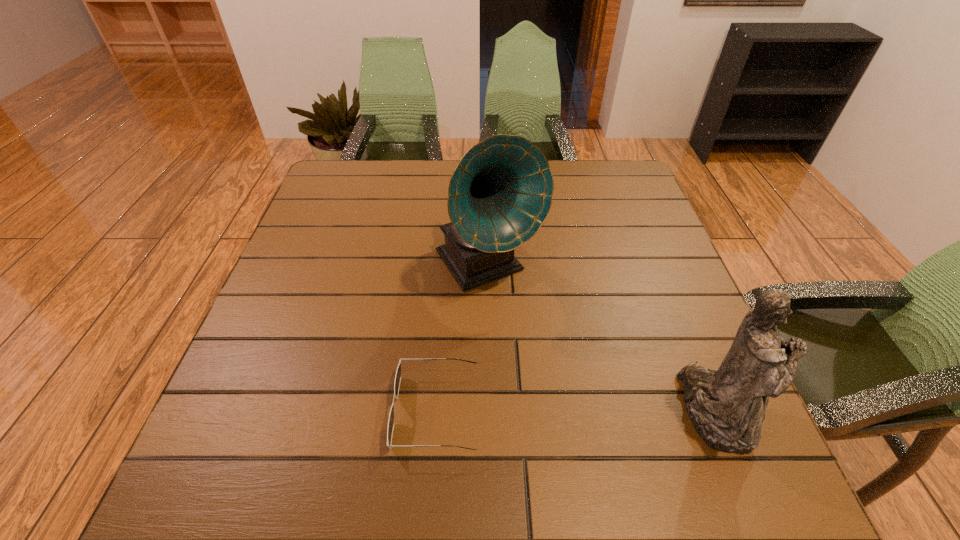
Image resolution: width=960 pixels, height=540 pixels. What are the coordinates of `vacant space on the desktop that is between the shortest object and the figurine and is positioned from the horn of the tallest object` in the screenshot? It's located at (594, 411).